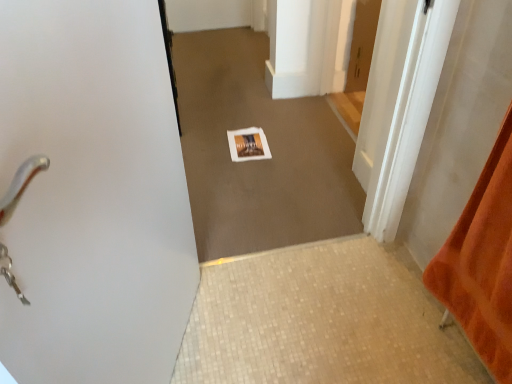
What do you see at coordinates (482, 262) in the screenshot?
I see `orange fabric at right` at bounding box center [482, 262].

Locate an element on the screen. Image resolution: width=512 pixels, height=384 pixels. orange fabric at right is located at coordinates (482, 262).

Locate an element on the screen. wooden door at center, arranged as the 2th door when viewed from the back is located at coordinates (387, 82).

Locate an element on the screen. The height and width of the screenshot is (384, 512). brown matte door at upper right, marked as the 2th door in a front-to-back arrangement is located at coordinates (362, 44).

Locate an element on the screen. orange fabric at right is located at coordinates pyautogui.click(x=482, y=262).

Which object is more forward, orange fabric at right or white paper at center?

orange fabric at right is more forward.

From the image's perspective, is orange fabric at right over white paper at center?

Actually, orange fabric at right appears below white paper at center in the image.

Considering the sizes of objects orange fabric at right and white paper at center in the image provided, who is wider, orange fabric at right or white paper at center?

white paper at center.

What are the coordinates of `corridor located behind the orange fabric at right` in the screenshot? It's located at (258, 161).

This screenshot has height=384, width=512. Find the location of `door lying behind the wooden door at center, arranged as the 2th door when viewed from the back`. door lying behind the wooden door at center, arranged as the 2th door when viewed from the back is located at coordinates (362, 44).

Considering the sizes of wooden door at center, arranged as the 2th door when viewed from the back, and brown matte door at upper right, marked as the 2th door in a front-to-back arrangement, in the image, is wooden door at center, arranged as the 2th door when viewed from the back, taller or shorter than brown matte door at upper right, marked as the 2th door in a front-to-back arrangement,?

Clearly, wooden door at center, arranged as the 2th door when viewed from the back, is taller compared to brown matte door at upper right, marked as the 2th door in a front-to-back arrangement.

From a real-world perspective, is wooden door at center, the first door when ordered from front to back, physically below brown matte door at upper right, which is the 1th door from back to front?

No, from a real-world perspective, wooden door at center, the first door when ordered from front to back, is not below brown matte door at upper right, which is the 1th door from back to front.

Between brown matte door at upper right, which is the 1th door from back to front, and white paper at center, which one has larger size?

Bigger between the two is white paper at center.

Is brown matte door at upper right, which is the 1th door from back to front, located outside white paper at center?

brown matte door at upper right, which is the 1th door from back to front, is positioned outside white paper at center.

Is brown matte door at upper right, marked as the 2th door in a front-to-back arrangement, not near white paper at center?

Actually, brown matte door at upper right, marked as the 2th door in a front-to-back arrangement, and white paper at center are a little close together.

Consider the image. Which object is further away from the camera taking this photo, brown matte door at upper right, marked as the 2th door in a front-to-back arrangement, or white paper at center?

brown matte door at upper right, marked as the 2th door in a front-to-back arrangement, is behind.

From the image's perspective, which one is positioned higher, white paper at center or beige mosaic tile at lower center?

white paper at center is shown above in the image.

Is white paper at center turned away from beige mosaic tile at lower center?

No, white paper at center is not facing the opposite direction of beige mosaic tile at lower center.

Between white paper at center and beige mosaic tile at lower center, which one has larger width?

With larger width is beige mosaic tile at lower center.

Is white paper at center thinner than orange fabric at right?

Incorrect, the width of white paper at center is not less than that of orange fabric at right.

Is white paper at center at the left side of orange fabric at right?

Yes, white paper at center is to the left of orange fabric at right.

Measure the distance between white paper at center and orange fabric at right.

The distance of white paper at center from orange fabric at right is 36.33 inches.

Can you see white paper at center touching orange fabric at right?

No.

Is orange fabric at right outside of wooden door at center, arranged as the 2th door when viewed from the back?

Yes, orange fabric at right is not within wooden door at center, arranged as the 2th door when viewed from the back.

Are orange fabric at right and wooden door at center, the first door when ordered from front to back, beside each other?

No, orange fabric at right is not making contact with wooden door at center, the first door when ordered from front to back.

Which object is wider, orange fabric at right or wooden door at center, arranged as the 2th door when viewed from the back?

Wider between the two is wooden door at center, arranged as the 2th door when viewed from the back.

Does point (508, 332) come behind point (385, 37)?

No, it is in front of (385, 37).

Is orange fabric at right oriented towards brown matte door at upper right, which is the 1th door from back to front?

No, orange fabric at right is not turned towards brown matte door at upper right, which is the 1th door from back to front.

Which is more to the left, orange fabric at right or brown matte door at upper right, marked as the 2th door in a front-to-back arrangement?

From the viewer's perspective, orange fabric at right appears more on the left side.

From a real-world perspective, is orange fabric at right under brown matte door at upper right, marked as the 2th door in a front-to-back arrangement?

No, from a real-world perspective, orange fabric at right is not below brown matte door at upper right, marked as the 2th door in a front-to-back arrangement.

Is orange fabric at right taller or shorter than brown matte door at upper right, marked as the 2th door in a front-to-back arrangement?

Clearly, orange fabric at right is taller compared to brown matte door at upper right, marked as the 2th door in a front-to-back arrangement.

Where is `blanket positioned vertically above the white paper at center (from a real-world perspective)`? The height and width of the screenshot is (384, 512). blanket positioned vertically above the white paper at center (from a real-world perspective) is located at coordinates (482, 262).

Where is `door on the right side of wooden door at center, the first door when ordered from front to back`? The image size is (512, 384). door on the right side of wooden door at center, the first door when ordered from front to back is located at coordinates (362, 44).

Which object lies further to the anchor point beige mosaic tile at lower center, brown matte door at upper right, which is the 1th door from back to front, or white paper at center?

brown matte door at upper right, which is the 1th door from back to front, is further to beige mosaic tile at lower center.

From the image, which object appears to be nearer to brown matte door at upper right, marked as the 2th door in a front-to-back arrangement, orange fabric at right or wooden door at center, arranged as the 2th door when viewed from the back?

The object closer to brown matte door at upper right, marked as the 2th door in a front-to-back arrangement, is wooden door at center, arranged as the 2th door when viewed from the back.

From the image, which object appears to be farther from white paper at center, beige mosaic tile at lower center or brown matte door at upper right, marked as the 2th door in a front-to-back arrangement?

Among the two, brown matte door at upper right, marked as the 2th door in a front-to-back arrangement, is located further to white paper at center.

Based on the photo, based on their spatial positions, is brown matte door at upper right, marked as the 2th door in a front-to-back arrangement, or orange fabric at right further from wooden door at center, arranged as the 2th door when viewed from the back?

The object further to wooden door at center, arranged as the 2th door when viewed from the back, is brown matte door at upper right, marked as the 2th door in a front-to-back arrangement.

When comparing their distances from beige mosaic tile at lower center, does wooden door at center, the first door when ordered from front to back, or white paper at center seem closer?

white paper at center is closer to beige mosaic tile at lower center.

When comparing their distances from wooden door at center, arranged as the 2th door when viewed from the back, does white paper at center or brown matte door at upper right, marked as the 2th door in a front-to-back arrangement, seem closer?

white paper at center.

Based on the photo, considering their positions, is orange fabric at right positioned closer to brown matte door at upper right, marked as the 2th door in a front-to-back arrangement, than beige mosaic tile at lower center?

beige mosaic tile at lower center lies closer to brown matte door at upper right, marked as the 2th door in a front-to-back arrangement, than the other object.

Based on their spatial positions, is beige mosaic tile at lower center or wooden door at center, arranged as the 2th door when viewed from the back, further from white paper at center?

Based on the image, wooden door at center, arranged as the 2th door when viewed from the back, appears to be further to white paper at center.

Find the location of a particular element. The width and height of the screenshot is (512, 384). door between brown matte door at upper right, marked as the 2th door in a front-to-back arrangement, and beige mosaic tile at lower center in the up-down direction is located at coordinates (387, 82).

The height and width of the screenshot is (384, 512). In order to click on corridor that lies between wooden door at center, the first door when ordered from front to back, and beige mosaic tile at lower center from top to bottom in this screenshot , I will do `click(258, 161)`.

Identify the location of door between white paper at center and brown matte door at upper right, which is the 1th door from back to front, from front to back. This screenshot has height=384, width=512. pos(387,82).

Find the location of `corridor between orange fabric at right and brown matte door at upper right, marked as the 2th door in a front-to-back arrangement, from front to back`. corridor between orange fabric at right and brown matte door at upper right, marked as the 2th door in a front-to-back arrangement, from front to back is located at coordinates (258, 161).